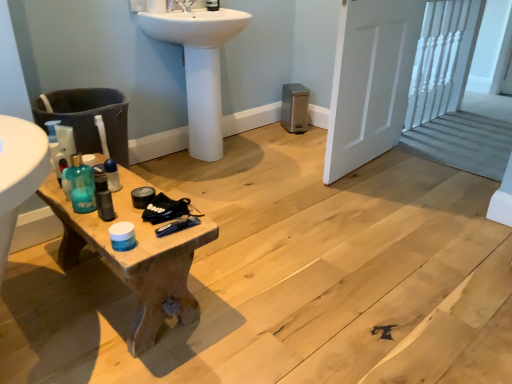
The image size is (512, 384). I want to click on vacant area that lies in front of woodenwoodentable at left, so click(x=84, y=350).